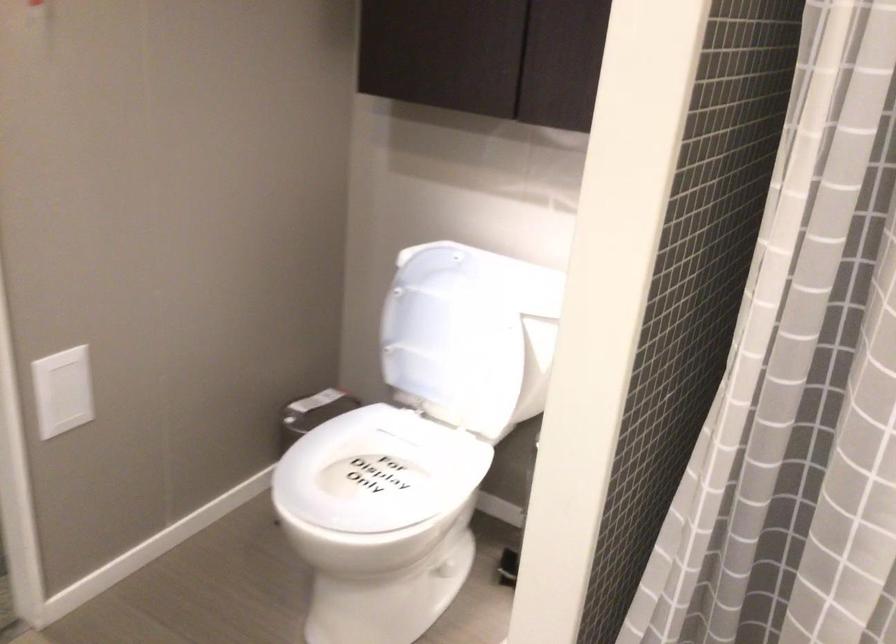
This screenshot has height=644, width=896. What do you see at coordinates (373, 480) in the screenshot?
I see `the white toilet seat` at bounding box center [373, 480].